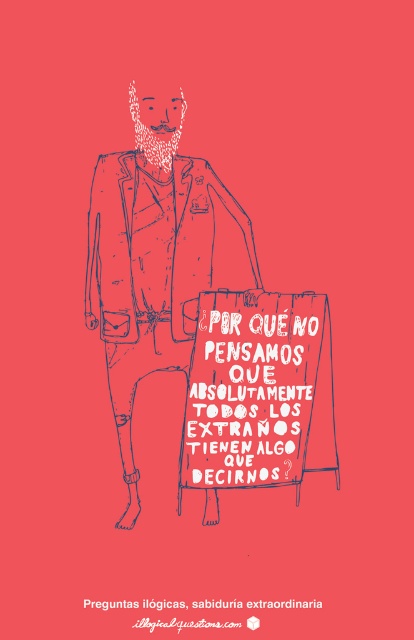
Looking at the image, which object is bigger between the blue sketchy jacket at center and the red cardboard sign at center?

The blue sketchy jacket at center is larger in size compared to the red cardboard sign at center.

You are an observer looking at the image. You notice the blue sketchy jacket at center and the red cardboard sign at center. Which object is located to the left of the other?

The blue sketchy jacket at center is positioned on the left side of the red cardboard sign at center.